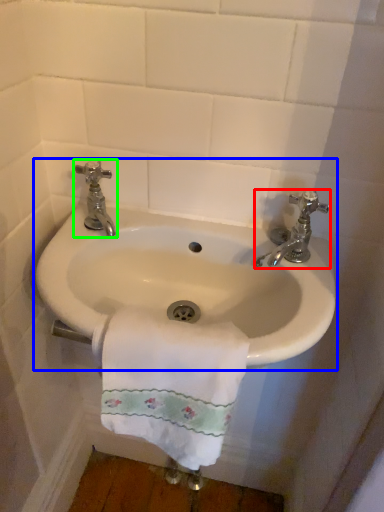
Question: Estimate the real-world distances between objects in this image. Which object is farther from tap (highlighted by a red box), sink (highlighted by a blue box) or tap (highlighted by a green box)?

Choices:
 (A) sink
 (B) tap

Answer: (B)